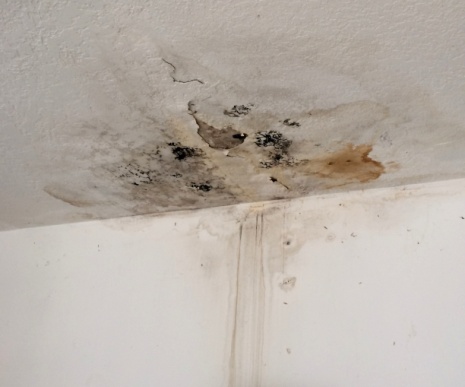
This screenshot has width=465, height=387. Find the location of `empty space on wall left of stains`. empty space on wall left of stains is located at coordinates (48, 317).